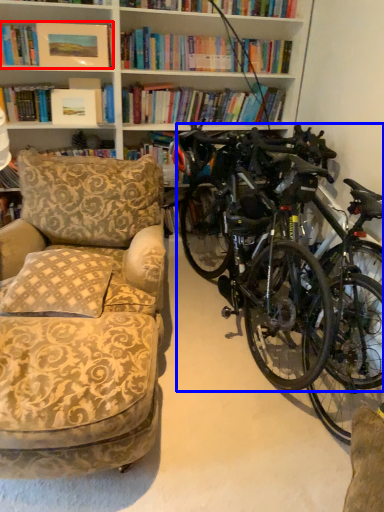
Question: Which point is closer to the camera, book (highlighted by a red box) or bicycle (highlighted by a blue box)?

Choices:
 (A) book
 (B) bicycle

Answer: (B)